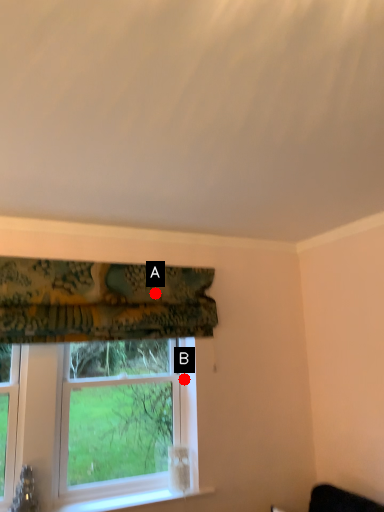
Question: Two points are circled on the image, labeled by A and B beside each circle. Which point is further to the camera?

Choices:
 (A) A is further
 (B) B is further

Answer: (B)